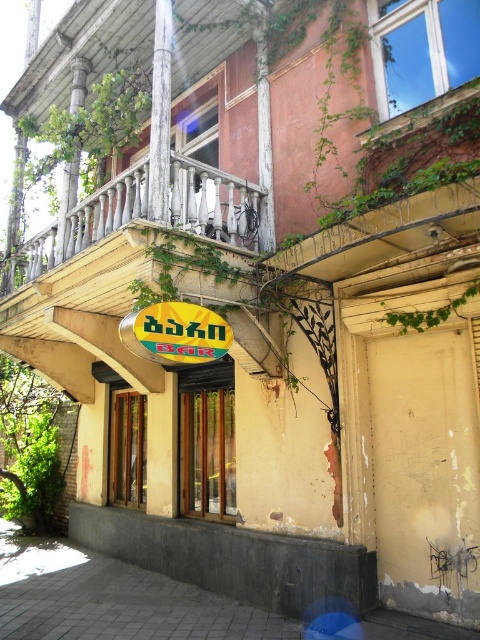
You are a delivery person trying to locate the entrance to the building. You see the rusty metal balcony at upper center and the yellow matte sign at center. Which object is closer to you, and why?

The rusty metal balcony at upper center is closer to you because it is in front of the yellow matte sign at center, meaning it is positioned nearer to your viewpoint.

You are standing in front of the building and want to locate the rusty metal balcony at upper center. What are the coordinates of it?

The coordinates of the rusty metal balcony at upper center are at point (382, 236).

You are a delivery person who needs to attach a package to the rusty metal balcony at upper center. The yellow matte sign at center is blocking your path. Can you fit the package between them?

The rusty metal balcony at upper center is wider than the yellow matte sign at center, so there might be enough space to fit the package between them.